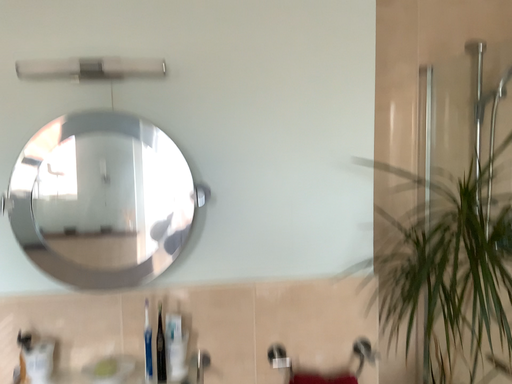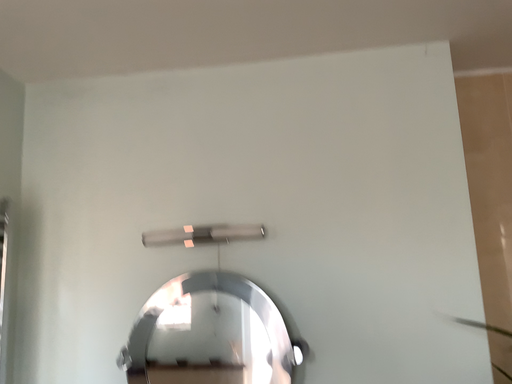
Question: Which way did the camera rotate in the video?

Choices:
 (A) rotated downward
 (B) rotated upward

Answer: (B)